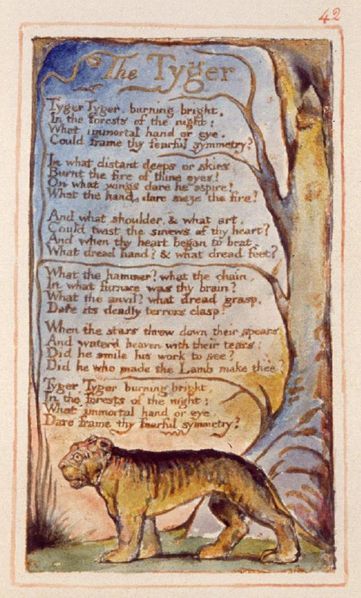
Find the location of a particular element. frame (text) is located at coordinates (97, 425).